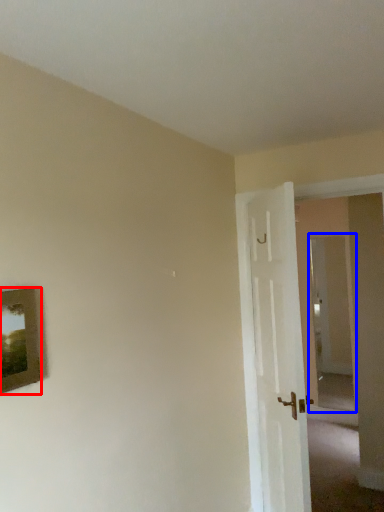
Question: Which object is further to the camera taking this photo, picture frame (highlighted by a red box) or glass door (highlighted by a blue box)?

Choices:
 (A) picture frame
 (B) glass door

Answer: (B)